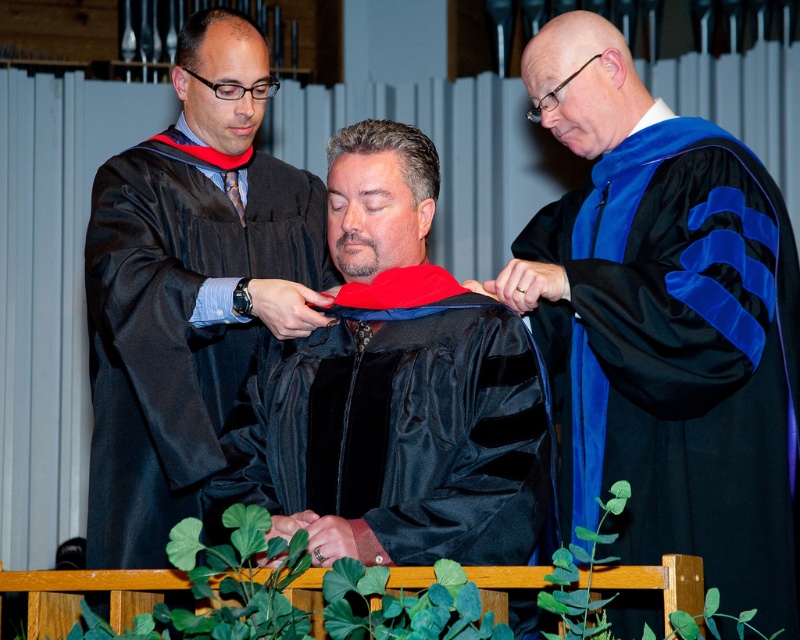
You are an event organizer arranging seating for the ceremony. You need to ensure that the black satin graduation gown at center and the matte black graduation gown at left can fit comfortably side by side on a bench. Given that the bench is 1.2 meters wide, can both gowns fit without overlapping?

The black satin graduation gown at center is wider than the matte black graduation gown at left. Since their combined width would exceed the bench width of 1.2 meters, they cannot fit comfortably without overlapping.

You are an attendee at the ceremony and want to take a photo of the black satin graduation gown at center. The photographer tells you that the gown must be positioned at the center point of the image, which is at coordinates 0.5, 0.5. Is the gown currently positioned correctly?

The black satin graduation gown at center is located at coordinates (664,324), which is slightly to the right and much lower than the true center point of (400,320). Therefore, it is not positioned correctly for the photo.

You are a photographer positioned at the back of the auditorium. You need to capture a clear photo of the black satin graduation gown at center and the matte black graduation gown at left. Which gown will appear closer to the camera in the photo?

The black satin graduation gown at center will appear closer to the camera in the photo because it is positioned in front of the matte black graduation gown at left.